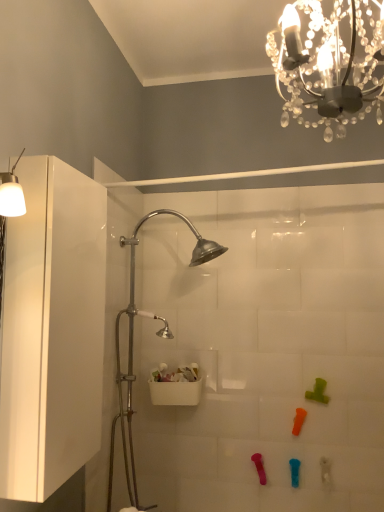
The image size is (384, 512). What do you see at coordinates (298, 420) in the screenshot?
I see `orange rubber toy at lower center, the third toy viewed from the left` at bounding box center [298, 420].

Identify the location of orange rubber toy at lower center, the third toy viewed from the left. (298, 420).

Locate an element on the screen. The width and height of the screenshot is (384, 512). white plastic shower door at center is located at coordinates (133, 339).

The width and height of the screenshot is (384, 512). What do you see at coordinates (294, 472) in the screenshot?
I see `blue rubber toy at lower center, the second toy when ordered from left to right` at bounding box center [294, 472].

You are a GUI agent. You are given a task and a screenshot of the screen. Output one action in this format:
    pyautogui.click(x=<x>, y=<y>)
    Task: Click on the clear crystal chandelier at upper center
    The height and width of the screenshot is (512, 384).
    Given the screenshot: What is the action you would take?
    pyautogui.click(x=329, y=63)

The height and width of the screenshot is (512, 384). I want to click on green rubber toy at upper right, the second toy viewed from the right, so click(318, 392).

Find the location of `orange rubber toy at lower center, the third toy viewed from the left`. orange rubber toy at lower center, the third toy viewed from the left is located at coordinates (298, 420).

From the image's perspective, is clear crystal chandelier at upper center on white glossy cabinet at left?

Yes, from the image's perspective, clear crystal chandelier at upper center is on top of white glossy cabinet at left.

Image resolution: width=384 pixels, height=512 pixels. I want to click on light fixture that appears in front of the white glossy cabinet at left, so click(x=329, y=63).

Can you confirm if clear crystal chandelier at upper center is shorter than white glossy cabinet at left?

Indeed, clear crystal chandelier at upper center has a lesser height compared to white glossy cabinet at left.

Is clear crystal chandelier at upper center far away from white glossy cabinet at left?

No.

Is white plastic container at center positioned with its back to orange rubber toy at lower center, the third toy viewed from the left?

No, white plastic container at center is not facing away from orange rubber toy at lower center, the third toy viewed from the left.

Is point (162, 367) less distant than point (295, 421)?

That is False.

Is white plastic container at center wider or thinner than orange rubber toy at lower center, the third toy viewed from the left?

white plastic container at center is wider than orange rubber toy at lower center, the third toy viewed from the left.

Is orange rubber toy at lower center, the third toy viewed from the left, far from white plastic container at center?

orange rubber toy at lower center, the third toy viewed from the left, is actually quite close to white plastic container at center.

From the picture: Can you tell me how much orange rubber toy at lower center, the third toy viewed from the left, and white plastic container at center differ in facing direction?

The facing directions of orange rubber toy at lower center, the third toy viewed from the left, and white plastic container at center are 1.9 degrees apart.

Is orange rubber toy at lower center, the third toy viewed from the left, located outside white plastic container at center?

orange rubber toy at lower center, the third toy viewed from the left, is positioned outside white plastic container at center.

Starting from the white plastic container at center, which toy is the 1st one in front? Please provide its 2D coordinates.

[(298, 420)]

Can you confirm if white plastic shower door at center is positioned to the right of green rubber toy at upper right, which ranks as the fourth toy in left-to-right order?

No.

Identify the location of shower door in front of the green rubber toy at upper right, the second toy viewed from the right. coord(133,339).

Is white plastic shower door at center situated inside green rubber toy at upper right, the second toy viewed from the right, or outside?

white plastic shower door at center exists outside the volume of green rubber toy at upper right, the second toy viewed from the right.

Is green rubber toy at upper right, the second toy viewed from the right, surrounding white plastic container at center?

No, white plastic container at center is not surrounded by green rubber toy at upper right, the second toy viewed from the right.

From the image's perspective, is green rubber toy at upper right, which ranks as the fourth toy in left-to-right order, located beneath white plastic container at center?

No, from the image's perspective, green rubber toy at upper right, which ranks as the fourth toy in left-to-right order, is not below white plastic container at center.

Locate an element on the screen. The height and width of the screenshot is (512, 384). toy that appears above the white plastic container at center (from a real-world perspective) is located at coordinates (318, 392).

Which of these two, green rubber toy at upper right, the second toy viewed from the right, or white plastic container at center, stands taller?

Standing taller between the two is green rubber toy at upper right, the second toy viewed from the right.

Does white plastic container at center have a greater width compared to white plastic shower door at center?

In fact, white plastic container at center might be narrower than white plastic shower door at center.

At what (x,y) coordinates should I click in order to perform the action: click on sink on the left of the white plastic shower door at center. Please return your answer as a coordinate pair (x, y). Looking at the image, I should click on (176, 386).

Is white plastic shower door at center located within white plastic container at center?

No, white plastic shower door at center is not a part of white plastic container at center.

Between point (167, 331) and point (58, 441), which one is positioned behind?

The point (167, 331) is more distant.

From the picture: Is white plastic shower door at center further to camera compared to white glossy cabinet at left?

Yes, it is.

From the picture: Is white plastic shower door at center to the left or to the right of white glossy cabinet at left in the image?

white plastic shower door at center is positioned on white glossy cabinet at left's right side.

Where is `glass door on the left of the clear crystal chandelier at upper center`? This screenshot has width=384, height=512. glass door on the left of the clear crystal chandelier at upper center is located at coordinates click(x=52, y=330).

Locate an element on the screen. This screenshot has width=384, height=512. sink above the orange rubber toy at lower center, the third toy positioned from the right (from the image's perspective) is located at coordinates (176, 386).

Considering their positions, is white glossy cabinet at left positioned closer to pink rubber toy at lower center, the 1th toy when ordered from left to right, than white plastic container at center?

white plastic container at center is positioned closer to the anchor pink rubber toy at lower center, the 1th toy when ordered from left to right.

When comparing their distances from pink rubber toy at lower center, positioned as the 5th toy in right-to-left order, does orange rubber toy at lower center, the third toy positioned from the right, or clear crystal chandelier at upper center seem further?

clear crystal chandelier at upper center.

Which object lies nearer to the anchor point orange rubber toy at lower center, the third toy positioned from the right, translucent plastic toy at lower right, arranged as the 1th toy when viewed from the right, or white glossy cabinet at left?

translucent plastic toy at lower right, arranged as the 1th toy when viewed from the right.

Considering their positions, is translucent plastic toy at lower right, which is the 5th toy from left to right, positioned closer to white glossy cabinet at left than blue rubber toy at lower center, the second toy when ordered from left to right?

blue rubber toy at lower center, the second toy when ordered from left to right, lies closer to white glossy cabinet at left than the other object.

Looking at this image, based on their spatial positions, is white plastic shower door at center or translucent plastic toy at lower right, arranged as the 1th toy when viewed from the right, closer to clear crystal chandelier at upper center?

Based on the image, white plastic shower door at center appears to be nearer to clear crystal chandelier at upper center.

Estimate the real-world distances between objects in this image. Which object is closer to green rubber toy at upper right, which ranks as the fourth toy in left-to-right order, blue rubber toy at lower center, the second toy when ordered from left to right, or pink rubber toy at lower center, positioned as the 5th toy in right-to-left order?

Among the two, blue rubber toy at lower center, the second toy when ordered from left to right, is located nearer to green rubber toy at upper right, which ranks as the fourth toy in left-to-right order.

Considering their positions, is white plastic container at center positioned further to orange rubber toy at lower center, the third toy positioned from the right, than blue rubber toy at lower center, which is counted as the 4th toy, starting from the right?

The object further to orange rubber toy at lower center, the third toy positioned from the right, is white plastic container at center.

Estimate the real-world distances between objects in this image. Which object is closer to pink rubber toy at lower center, the 1th toy when ordered from left to right, clear crystal chandelier at upper center or white plastic container at center?

white plastic container at center lies closer to pink rubber toy at lower center, the 1th toy when ordered from left to right, than the other object.

Where is `glass door between clear crystal chandelier at upper center and blue rubber toy at lower center, the second toy when ordered from left to right, in the up-down direction`? glass door between clear crystal chandelier at upper center and blue rubber toy at lower center, the second toy when ordered from left to right, in the up-down direction is located at coordinates (52, 330).

Where is `sink between clear crystal chandelier at upper center and translucent plastic toy at lower right, which is the 5th toy from left to right, vertically`? The image size is (384, 512). sink between clear crystal chandelier at upper center and translucent plastic toy at lower right, which is the 5th toy from left to right, vertically is located at coordinates (176, 386).

At what (x,y) coordinates should I click in order to perform the action: click on shower door between white plastic container at center and orange rubber toy at lower center, the third toy viewed from the left. Please return your answer as a coordinate pair (x, y). Looking at the image, I should click on (133, 339).

Where is `toy between orange rubber toy at lower center, the third toy viewed from the left, and blue rubber toy at lower center, which is counted as the 4th toy, starting from the right, vertically`? Image resolution: width=384 pixels, height=512 pixels. toy between orange rubber toy at lower center, the third toy viewed from the left, and blue rubber toy at lower center, which is counted as the 4th toy, starting from the right, vertically is located at coordinates (259, 467).